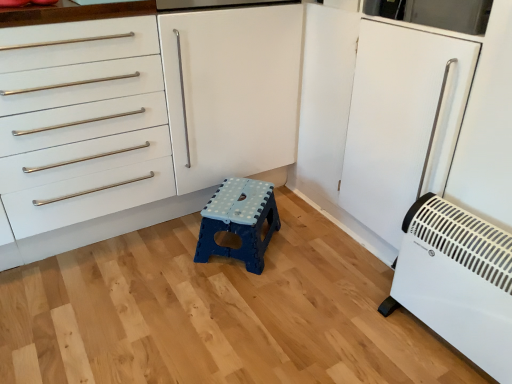
Question: Is white matte cabinet at center to the left or to the right of blue plastic stool at center in the image?

Choices:
 (A) right
 (B) left

Answer: (B)

Question: Considering the positions of white matte cabinet at center and blue plastic stool at center in the image, is white matte cabinet at center taller or shorter than blue plastic stool at center?

Choices:
 (A) tall
 (B) short

Answer: (A)

Question: Estimate the real-world distances between objects in this image. Which object is closer to the white plastic heater at lower right?

Choices:
 (A) blue plastic stool at center
 (B) white matte cabinet at center

Answer: (A)

Question: Which object is positioned farthest from the white plastic heater at lower right?

Choices:
 (A) white matte cabinet at center
 (B) blue plastic stool at center

Answer: (A)